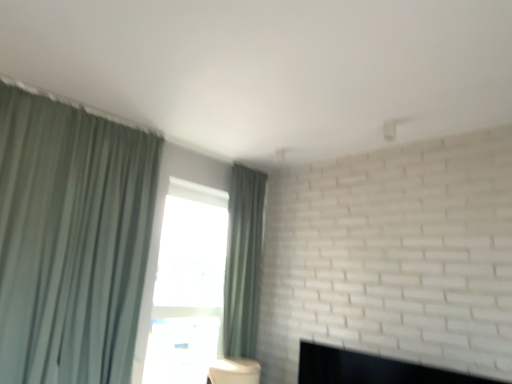
Question: From a real-world perspective, is black matte fireplace at lower right above or below green fabric curtain at center, placed as the second curtain when sorted from left to right?

Choices:
 (A) above
 (B) below

Answer: (B)

Question: Choose the correct answer: Is black matte fireplace at lower right inside green fabric curtain at center, positioned as the second curtain in front-to-back order, or outside it?

Choices:
 (A) inside
 (B) outside

Answer: (B)

Question: Which of these objects is positioned closest to the green fabric curtain at left, which ranks as the first curtain in front-to-back order?

Choices:
 (A) black matte fireplace at lower right
 (B) green fabric curtain at center, which is the 1th curtain in right-to-left order

Answer: (B)

Question: Which object is the closest to the green fabric curtain at center, which is the 1th curtain in right-to-left order?

Choices:
 (A) black matte fireplace at lower right
 (B) green fabric curtain at left, which is counted as the 1th curtain, starting from the left

Answer: (A)